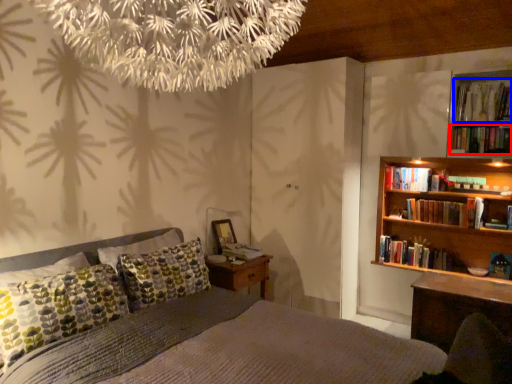
Question: Which object appears closest to the camera in this image, book (highlighted by a red box) or book (highlighted by a blue box)?

Choices:
 (A) book
 (B) book

Answer: (A)